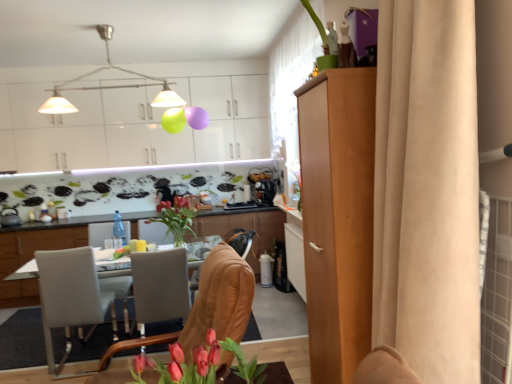
Question: From a real-world perspective, is smooth pink tulips at lower center, which is counted as the first floral arrangement, starting from the right, physically above leather at center, which is the first chair in front-to-back order?

Choices:
 (A) no
 (B) yes

Answer: (B)

Question: Are smooth pink tulips at lower center, arranged as the 1th floral arrangement when ordered from the bottom, and leather at center, which is the first chair in front-to-back order, far apart?

Choices:
 (A) yes
 (B) no

Answer: (B)

Question: Is leather at center, which is the first chair in front-to-back order, located within smooth pink tulips at lower center, arranged as the 1th floral arrangement when ordered from the bottom?

Choices:
 (A) yes
 (B) no

Answer: (B)

Question: Considering the relative sizes of smooth pink tulips at lower center, which appears as the 2th floral arrangement when viewed from the top, and leather at center, which is the second chair in back-to-front order, in the image provided, is smooth pink tulips at lower center, which appears as the 2th floral arrangement when viewed from the top, bigger than leather at center, which is the second chair in back-to-front order,?

Choices:
 (A) no
 (B) yes

Answer: (A)

Question: Is smooth pink tulips at lower center, the first floral arrangement viewed from the front, shorter than leather at center, the 2th chair in the left-to-right sequence?

Choices:
 (A) no
 (B) yes

Answer: (B)

Question: Considering the relative positions of smooth pink tulips at lower center, arranged as the 2th floral arrangement when viewed from the back, and leather at center, the 1th chair when ordered from right to left, in the image provided, is smooth pink tulips at lower center, arranged as the 2th floral arrangement when viewed from the back, to the left of leather at center, the 1th chair when ordered from right to left, from the viewer's perspective?

Choices:
 (A) no
 (B) yes

Answer: (A)

Question: From a real-world perspective, is beige fabric curtain at upper right, which is counted as the second curtain, starting from the front, positioned over white glossy table at center, the second cabinetry positioned from the front, based on gravity?

Choices:
 (A) yes
 (B) no

Answer: (A)

Question: Would you say beige fabric curtain at upper right, which is counted as the second curtain, starting from the front, is outside white glossy table at center, which is the 2th cabinetry from back to front?

Choices:
 (A) yes
 (B) no

Answer: (A)

Question: From a real-world perspective, is beige fabric curtain at upper right, the first curtain from the back, under white glossy table at center, which is the 2th cabinetry from back to front?

Choices:
 (A) no
 (B) yes

Answer: (A)

Question: Is beige fabric curtain at upper right, which is counted as the second curtain, starting from the front, oriented away from white glossy table at center, the second cabinetry positioned from the front?

Choices:
 (A) no
 (B) yes

Answer: (A)

Question: Is beige fabric curtain at upper right, which is counted as the second curtain, starting from the front, with white glossy table at center, the second cabinetry positioned from the front?

Choices:
 (A) no
 (B) yes

Answer: (A)

Question: Is beige fabric curtain at upper right, the first curtain from the back, smaller than white glossy table at center, the second cabinetry positioned from the front?

Choices:
 (A) yes
 (B) no

Answer: (A)

Question: Is satin black coffee machine at center shorter than vivid red flowers in glass vase at center, the 1th floral arrangement positioned from the back?

Choices:
 (A) yes
 (B) no

Answer: (B)